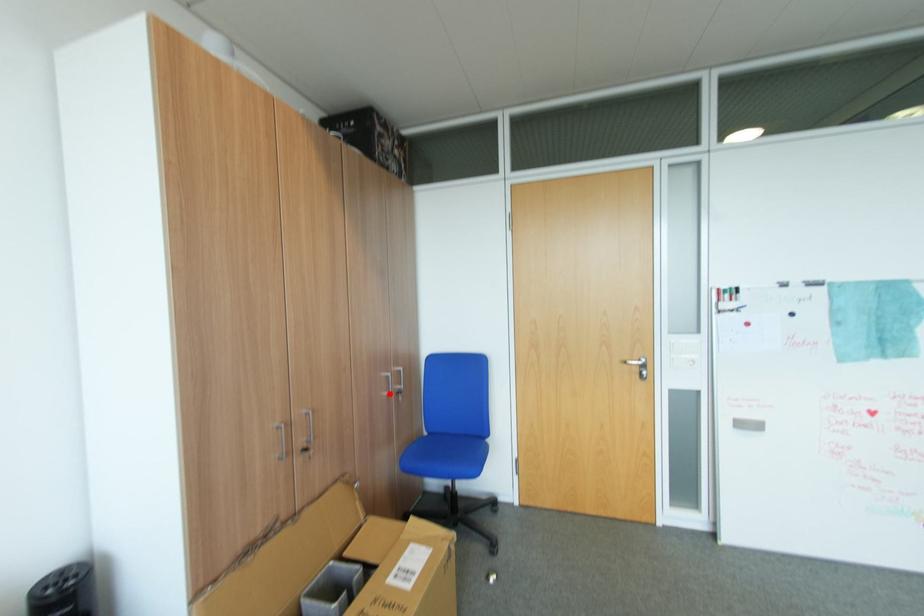
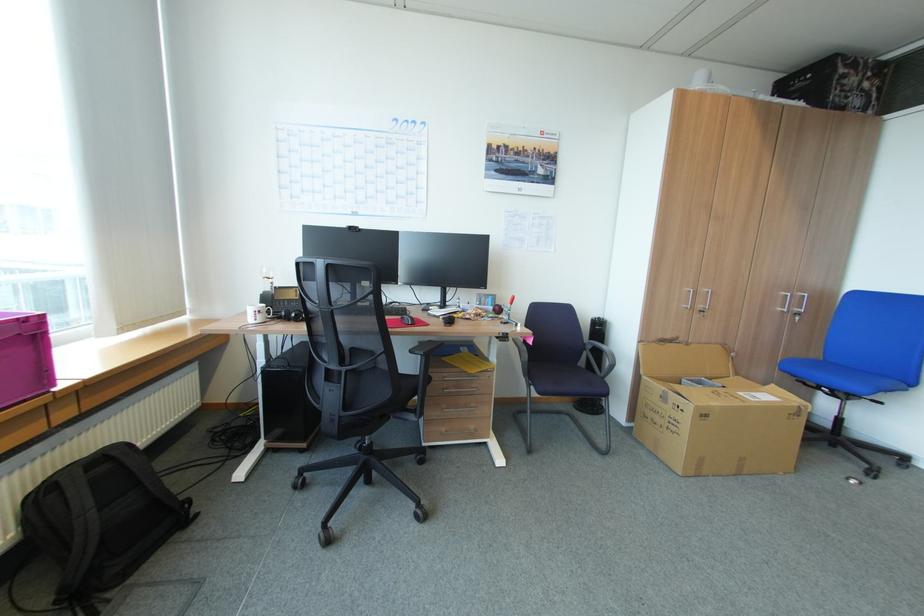
Question: I am providing you with two images of the same scene from different viewpoints. Given a red point in image1, look at the same physical point in image2. Is it:

Choices:
 (A) Closer to the viewpoint
 (B) Farther from the viewpoint

Answer: (A)